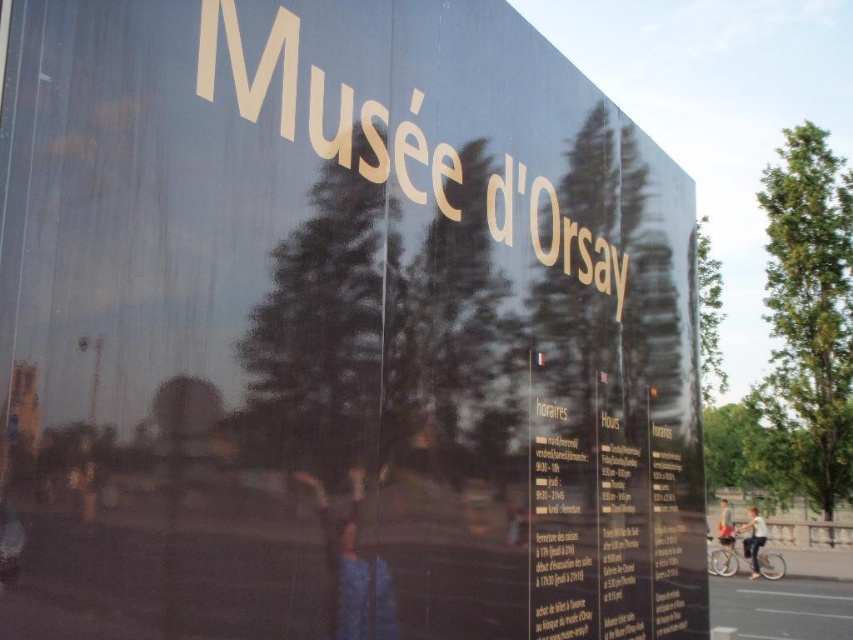
Question: Does light blue jeans at lower right lie behind light brown leather jacket at lower right?

Choices:
 (A) yes
 (B) no

Answer: (B)

Question: Is light blue jeans at lower right to the right of light brown leather jacket at lower right from the viewer's perspective?

Choices:
 (A) no
 (B) yes

Answer: (A)

Question: Is light blue jeans at lower right below light brown leather jacket at lower right?

Choices:
 (A) no
 (B) yes

Answer: (A)

Question: Which object is closer to the camera taking this photo?

Choices:
 (A) light brown leather jacket at lower right
 (B) light blue jeans at lower right

Answer: (B)